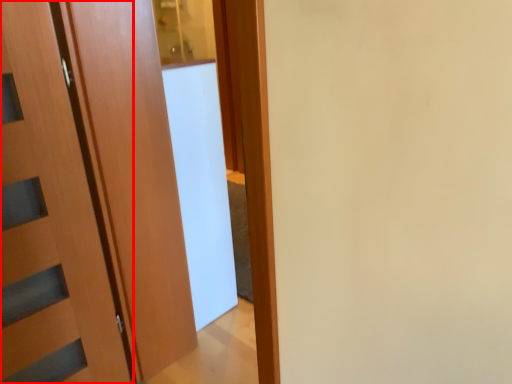
Question: Where is door (annotated by the red box) located in relation to screen door in the image?

Choices:
 (A) left
 (B) right

Answer: (A)